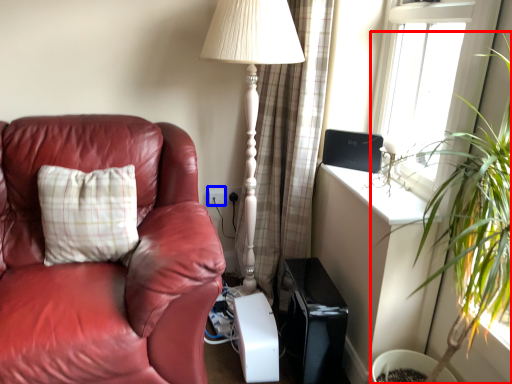
Question: Which point is further to the camera, houseplant (highlighted by a red box) or electric outlet (highlighted by a blue box)?

Choices:
 (A) houseplant
 (B) electric outlet

Answer: (B)